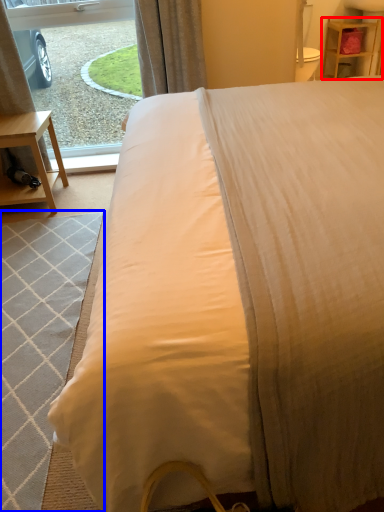
Question: Which point is closer to the camera, nightstand (highlighted by a red box) or mat (highlighted by a blue box)?

Choices:
 (A) nightstand
 (B) mat

Answer: (B)